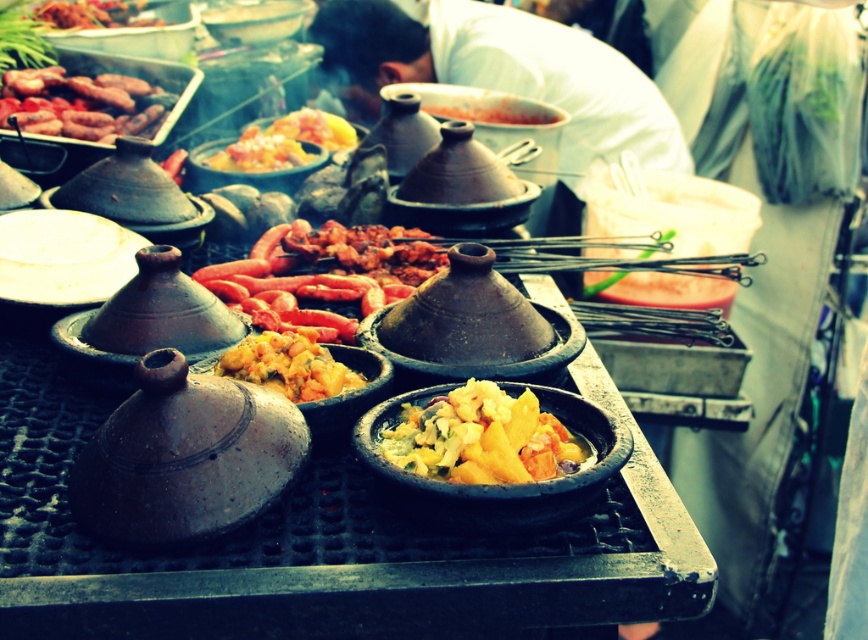
Is grilled sausages at center below yellowish matte tagine at center?

No, grilled sausages at center is not below yellowish matte tagine at center.

Measure the distance between grilled sausages at center and yellowish matte tagine at center.

grilled sausages at center is 17.54 inches from yellowish matte tagine at center.

I want to click on grilled sausages at center, so click(326, 273).

Where is `grilled sausages at center`? Image resolution: width=868 pixels, height=640 pixels. grilled sausages at center is located at coordinates (326, 273).

Does brown glossy sausages at left lie behind yellowish matte tagine at center?

Yes, it is behind yellowish matte tagine at center.

Can you confirm if brown glossy sausages at left is wider than yellowish matte tagine at center?

Indeed, brown glossy sausages at left has a greater width compared to yellowish matte tagine at center.

What do you see at coordinates (80, 104) in the screenshot?
I see `brown glossy sausages at left` at bounding box center [80, 104].

Image resolution: width=868 pixels, height=640 pixels. I want to click on brown glossy sausages at left, so click(80, 104).

Is yellowish matte clay bowl at center thinner than matte brown meat at upper left?

Indeed, yellowish matte clay bowl at center has a lesser width compared to matte brown meat at upper left.

This screenshot has height=640, width=868. I want to click on yellowish matte clay bowl at center, so click(x=481, y=436).